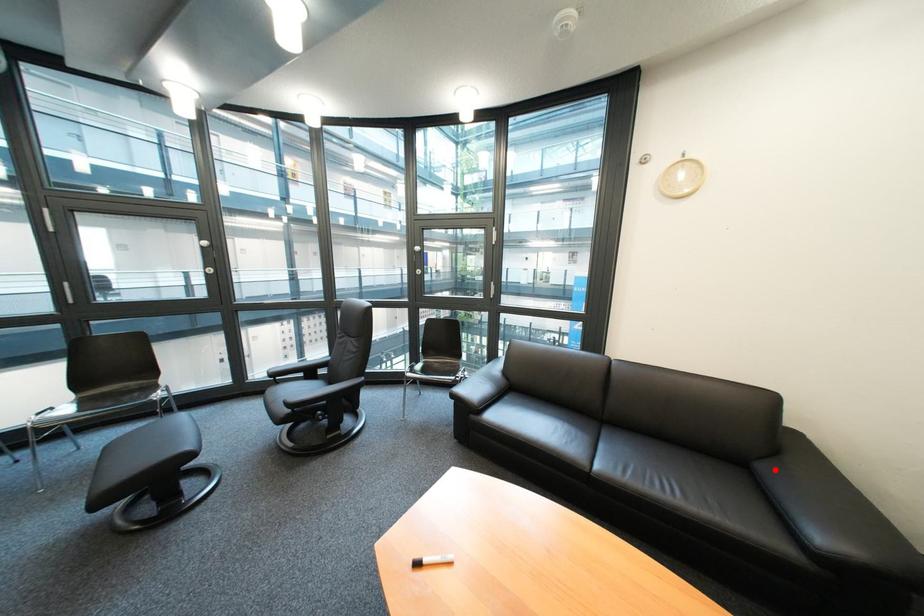
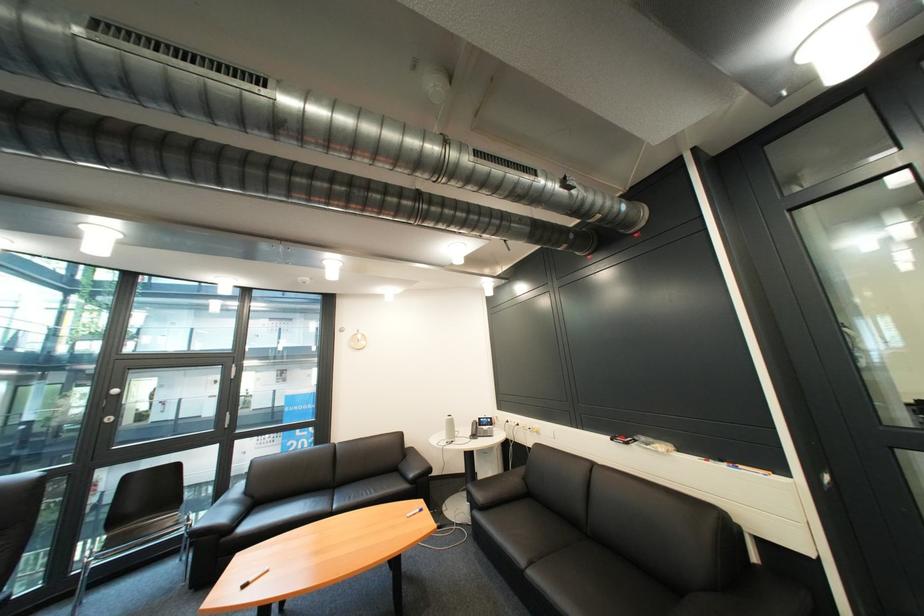
Find the pixel in the second image that matches the highlighted location in the first image.

(414, 468)